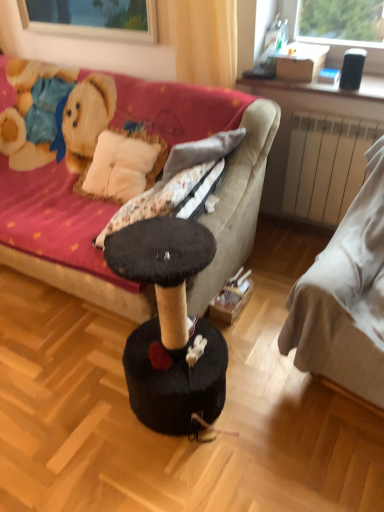
The height and width of the screenshot is (512, 384). I want to click on empty space that is ontop of white matte radiator at right (from a real-world perspective), so click(x=354, y=115).